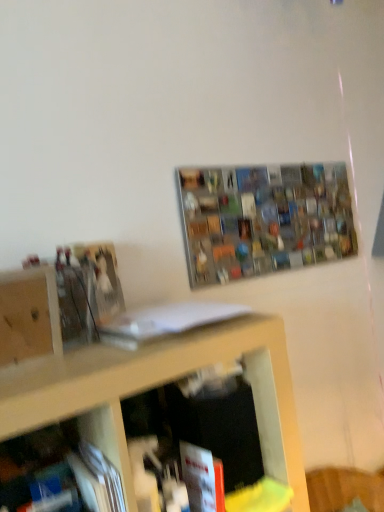
What is the approximate width of white matte book at center, the first book in the top-to-bottom sequence?

white matte book at center, the first book in the top-to-bottom sequence, is 11.70 inches wide.

What is the approximate height of wooden cabinet at left?

The height of wooden cabinet at left is 19.86 centimeters.

I want to click on metallic grid at upper center, so click(x=263, y=219).

Is red matte book at lower center, the second book viewed from the top, inside or outside of wooden cabinet at left?

red matte book at lower center, the second book viewed from the top, exists outside the volume of wooden cabinet at left.

From the image's perspective, is red matte book at lower center, the second book viewed from the top, located above wooden cabinet at left?

No, from the image's perspective, red matte book at lower center, the second book viewed from the top, is not over wooden cabinet at left.

Who is taller, red matte book at lower center, which ranks as the 1th book in bottom-to-top order, or wooden cabinet at left?

With more height is wooden cabinet at left.

Is metallic grid at upper center in front of or behind red matte book at lower center, which ranks as the 1th book in bottom-to-top order, in the image?

In the image, metallic grid at upper center appears behind red matte book at lower center, which ranks as the 1th book in bottom-to-top order.

Between metallic grid at upper center and red matte book at lower center, which ranks as the 1th book in bottom-to-top order, which one has smaller width?

metallic grid at upper center.

Considering the positions of point (315, 234) and point (214, 468), is point (315, 234) closer or farther from the camera than point (214, 468)?

Point (315, 234).

From the image's perspective, which one is positioned lower, metallic grid at upper center or red matte book at lower center, which ranks as the 1th book in bottom-to-top order?

red matte book at lower center, which ranks as the 1th book in bottom-to-top order.

Would you say white matte book at center, the first book in the top-to-bottom sequence, is part of metallic grid at upper center's contents?

Definitely not — white matte book at center, the first book in the top-to-bottom sequence, is not inside metallic grid at upper center.

Based on the photo, from the image's perspective, is metallic grid at upper center on white matte book at center, the first book in the top-to-bottom sequence?

Yes.

Considering the relative sizes of metallic grid at upper center and white matte book at center, arranged as the second book when ordered from the bottom, in the image provided, is metallic grid at upper center taller than white matte book at center, arranged as the second book when ordered from the bottom,?

Indeed, metallic grid at upper center has a greater height compared to white matte book at center, arranged as the second book when ordered from the bottom.

From their relative heights in the image, would you say red matte book at lower center, the second book viewed from the top, is taller or shorter than metallic grid at upper center?

In the image, red matte book at lower center, the second book viewed from the top, appears to be shorter than metallic grid at upper center.

Can you confirm if red matte book at lower center, the second book viewed from the top, is thinner than metallic grid at upper center?

No, red matte book at lower center, the second book viewed from the top, is not thinner than metallic grid at upper center.

Between red matte book at lower center, the second book viewed from the top, and metallic grid at upper center, which one is positioned in front?

red matte book at lower center, the second book viewed from the top, is in front.

Are red matte book at lower center, which ranks as the 1th book in bottom-to-top order, and metallic grid at upper center beside each other?

red matte book at lower center, which ranks as the 1th book in bottom-to-top order, and metallic grid at upper center are not in contact.

Can white matte book at center, arranged as the second book when ordered from the bottom, be found inside wooden cabinet at left?

No, white matte book at center, arranged as the second book when ordered from the bottom, is not inside wooden cabinet at left.

Is white matte book at center, the first book in the top-to-bottom sequence, at the back of wooden cabinet at left?

wooden cabinet at left is not turned away from white matte book at center, the first book in the top-to-bottom sequence.

In terms of height, does wooden cabinet at left look taller or shorter compared to white matte book at center, the first book in the top-to-bottom sequence?

In the image, wooden cabinet at left appears to be taller than white matte book at center, the first book in the top-to-bottom sequence.

From a real-world perspective, is wooden cabinet at left over white matte book at center, the first book in the top-to-bottom sequence?

Indeed, from a real-world perspective, wooden cabinet at left stands above white matte book at center, the first book in the top-to-bottom sequence.

In the image, is wooden cabinet at left positioned in front of or behind red matte book at lower center, which ranks as the 1th book in bottom-to-top order?

wooden cabinet at left is positioned closer to the viewer than red matte book at lower center, which ranks as the 1th book in bottom-to-top order.

Is wooden cabinet at left facing away from red matte book at lower center, the second book viewed from the top?

wooden cabinet at left is not turned away from red matte book at lower center, the second book viewed from the top.

Which object is wider, wooden cabinet at left or red matte book at lower center, which ranks as the 1th book in bottom-to-top order?

red matte book at lower center, which ranks as the 1th book in bottom-to-top order, is wider.

Considering the positions of points (220, 246) and (52, 303), is point (220, 246) farther from camera compared to point (52, 303)?

That is True.

How distant is metallic grid at upper center from wooden cabinet at left?

metallic grid at upper center and wooden cabinet at left are 81.01 centimeters apart from each other.

Is metallic grid at upper center turned away from wooden cabinet at left?

No, wooden cabinet at left is not at the back of metallic grid at upper center.

Which object is positioned more to the right, metallic grid at upper center or wooden cabinet at left?

metallic grid at upper center.

Which book is the 2nd one when counting from the right side of the wooden cabinet at left? Please provide its 2D coordinates.

[(202, 479)]

At what (x,y) coordinates should I click in order to perform the action: click on shelf above the red matte book at lower center, the second book viewed from the top (from a real-world perspective). Please return your answer as a coordinate pair (x, y). Image resolution: width=384 pixels, height=512 pixels. Looking at the image, I should click on (263, 219).

Estimate the real-world distances between objects in this image. Which object is further from white matte book at center, the first book in the top-to-bottom sequence, wooden cabinet at left or red matte book at lower center, the second book viewed from the top?

red matte book at lower center, the second book viewed from the top, is positioned further to the anchor white matte book at center, the first book in the top-to-bottom sequence.

When comparing their distances from metallic grid at upper center, does white matte book at center, arranged as the second book when ordered from the bottom, or red matte book at lower center, which ranks as the 1th book in bottom-to-top order, seem further?

red matte book at lower center, which ranks as the 1th book in bottom-to-top order, is further to metallic grid at upper center.

From the image, which object appears to be nearer to wooden cabinet at left, white matte book at center, the first book in the top-to-bottom sequence, or metallic grid at upper center?

Among the two, white matte book at center, the first book in the top-to-bottom sequence, is located nearer to wooden cabinet at left.

Based on their spatial positions, is wooden cabinet at left or red matte book at lower center, which ranks as the 1th book in bottom-to-top order, further from metallic grid at upper center?

wooden cabinet at left is positioned further to the anchor metallic grid at upper center.

When comparing their distances from white matte book at center, arranged as the second book when ordered from the bottom, does red matte book at lower center, the second book viewed from the top, or metallic grid at upper center seem closer?

Among the two, red matte book at lower center, the second book viewed from the top, is located nearer to white matte book at center, arranged as the second book when ordered from the bottom.

Which object lies nearer to the anchor point metallic grid at upper center, wooden cabinet at left or white matte book at center, the first book in the top-to-bottom sequence?

Based on the image, white matte book at center, the first book in the top-to-bottom sequence, appears to be nearer to metallic grid at upper center.

Based on the photo, from the image, which object appears to be farther from red matte book at lower center, the second book viewed from the top, wooden cabinet at left or metallic grid at upper center?

metallic grid at upper center is positioned further to the anchor red matte book at lower center, the second book viewed from the top.

Based on the photo, which object lies nearer to the anchor point white matte book at center, the first book in the top-to-bottom sequence, metallic grid at upper center or red matte book at lower center, the second book viewed from the top?

red matte book at lower center, the second book viewed from the top, is closer to white matte book at center, the first book in the top-to-bottom sequence.

In order to click on book between metallic grid at upper center and red matte book at lower center, the second book viewed from the top, from top to bottom in this screenshot , I will do `click(165, 321)`.

The height and width of the screenshot is (512, 384). In order to click on book between wooden cabinet at left and red matte book at lower center, the second book viewed from the top, in the vertical direction in this screenshot , I will do `click(165, 321)`.